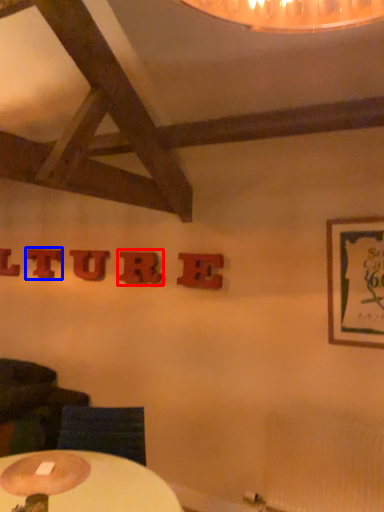
Question: Which object appears closest to the camera in this image, letter (highlighted by a red box) or letter (highlighted by a blue box)?

Choices:
 (A) letter
 (B) letter

Answer: (A)